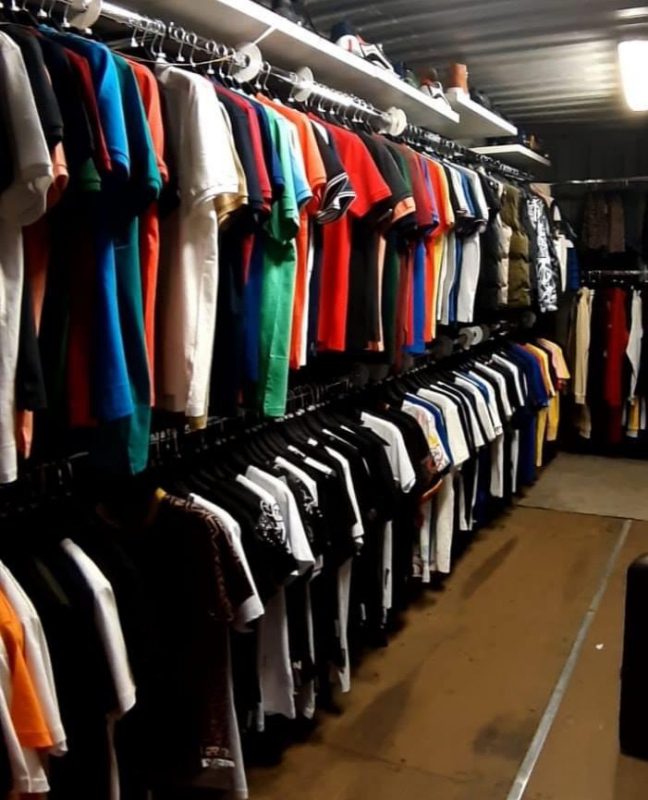
You are a GUI agent. You are given a task and a screenshot of the screen. Output one action in this format:
    pyautogui.click(x=<x>, y=<y>)
    Task: Click on the carpet
    The width and height of the screenshot is (648, 800).
    Given the screenshot: What is the action you would take?
    pyautogui.click(x=582, y=478)